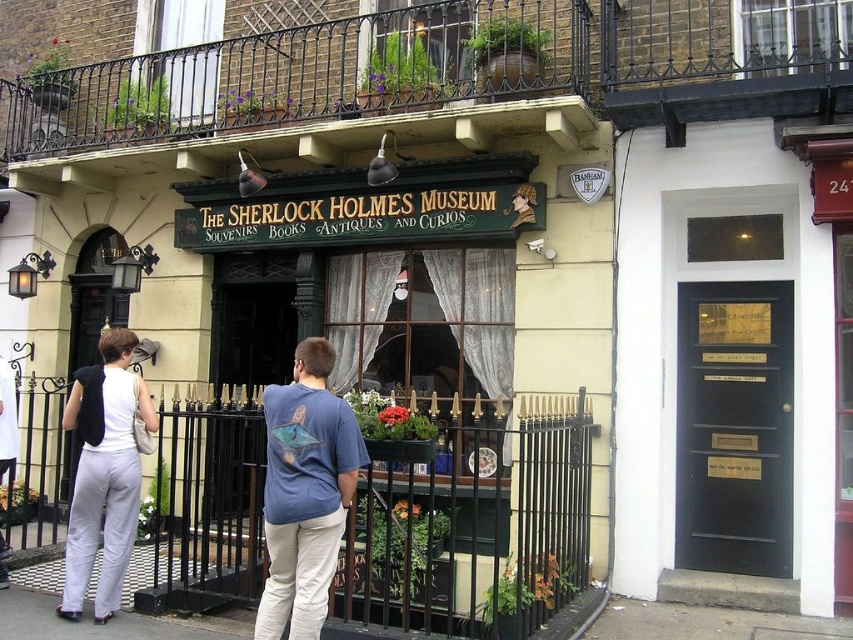
Who is positioned more to the right, black matte door at center or white matte vest at center?

black matte door at center

Does point (694, 301) come closer to viewer compared to point (132, 477)?

No, (694, 301) is further to viewer.

Where is `black matte door at center`? black matte door at center is located at coordinates (734, 428).

Between blue cotton t-shirt at center and white matte vest at center, which one appears on the right side from the viewer's perspective?

Positioned to the right is blue cotton t-shirt at center.

Can you confirm if blue cotton t-shirt at center is thinner than white matte vest at center?

Yes, blue cotton t-shirt at center is thinner than white matte vest at center.

The width and height of the screenshot is (853, 640). In order to click on blue cotton t-shirt at center in this screenshot , I will do `click(305, 492)`.

Who is lower down, white cotton pants at center or white matte vest at center?

white matte vest at center is lower down.

Does white cotton pants at center appear under white matte vest at center?

No.

Measure the distance between point (314,536) and camera.

Point (314,536) and camera are 4.35 meters apart.

I want to click on white cotton pants at center, so click(305, 492).